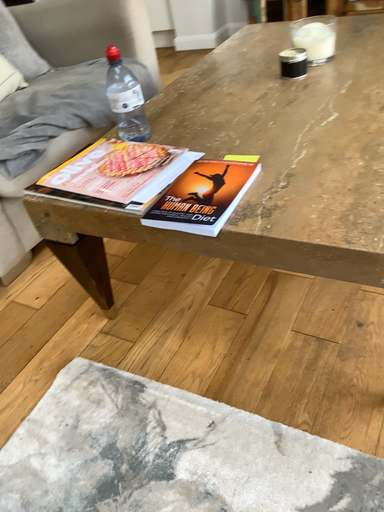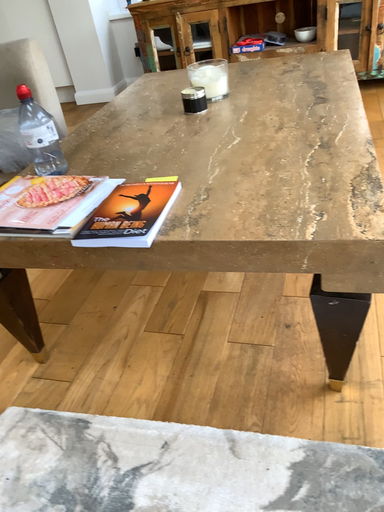
Question: How did the camera likely rotate when shooting the video?

Choices:
 (A) rotated right
 (B) rotated left

Answer: (A)